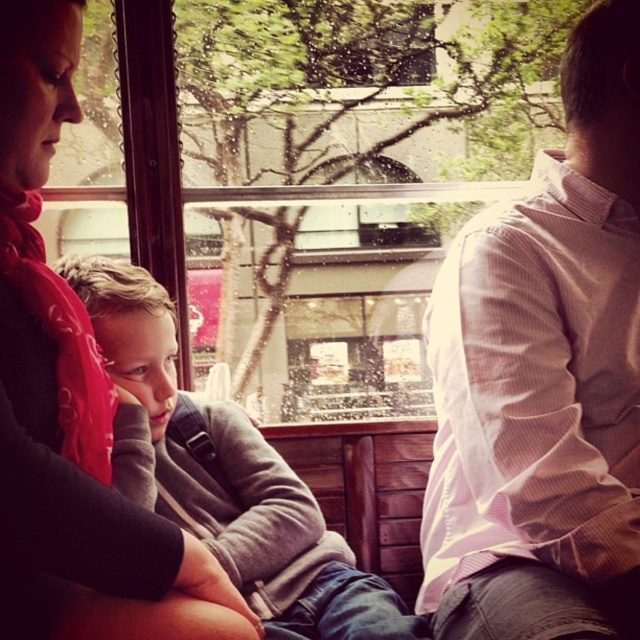
Question: Considering the relative positions of white striped shirt at right and gray fleece sweater at center in the image provided, where is white striped shirt at right located with respect to gray fleece sweater at center?

Choices:
 (A) above
 (B) below

Answer: (A)

Question: Is white striped shirt at right bigger than gray fleece sweater at center?

Choices:
 (A) yes
 (B) no

Answer: (B)

Question: Which point appears farthest from the camera in this image?

Choices:
 (A) pos(579,269)
 (B) pos(314,589)
 (C) pos(67,554)

Answer: (B)

Question: Which object is positioned farthest from the matte red scarf at upper left?

Choices:
 (A) white striped shirt at right
 (B) gray fleece sweater at center

Answer: (A)

Question: Which point is farther from the camera taking this photo?

Choices:
 (A) (492, 586)
 (B) (168, 472)

Answer: (B)

Question: Can you confirm if white striped shirt at right is wider than matte red scarf at upper left?

Choices:
 (A) yes
 (B) no

Answer: (A)